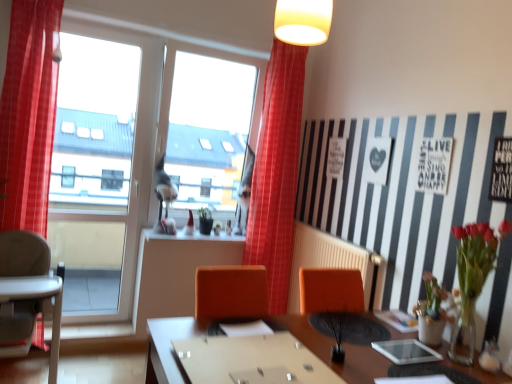
Where is `vacant space to the right of green matte plant at center, acting as the 2th plant starting from the top`? vacant space to the right of green matte plant at center, acting as the 2th plant starting from the top is located at coordinates [365, 355].